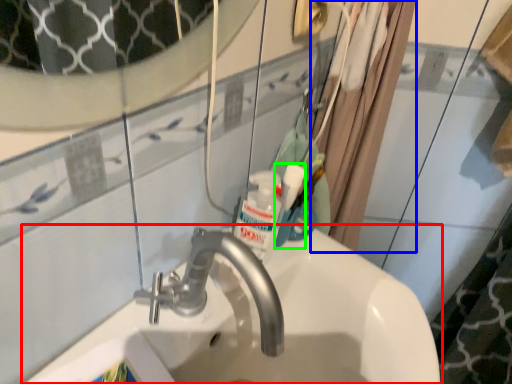
Question: Which object is the closest to the sink (highlighted by a red box)? Choose among these: shower curtain (highlighted by a blue box) or mouthwash (highlighted by a green box).

Choices:
 (A) shower curtain
 (B) mouthwash

Answer: (B)